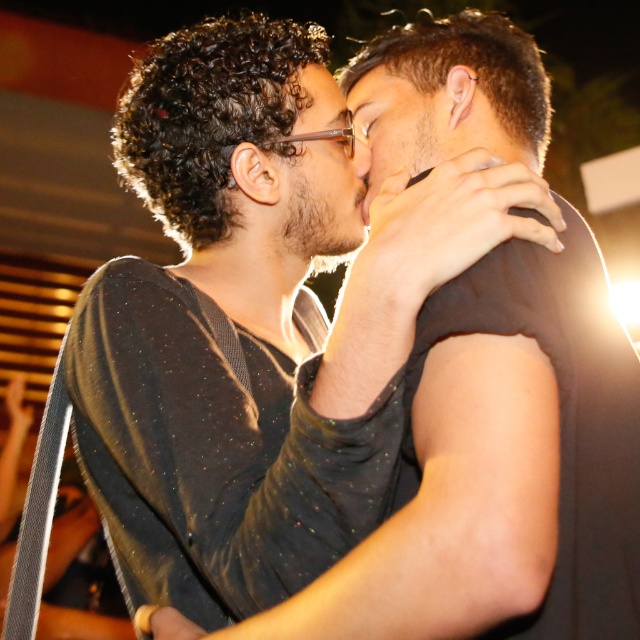
Which is more to the left, matte black face at center or smooth skin face at center?

matte black face at center

What do you see at coordinates (317, 196) in the screenshot?
I see `matte black face at center` at bounding box center [317, 196].

Where is `matte black face at center`? matte black face at center is located at coordinates point(317,196).